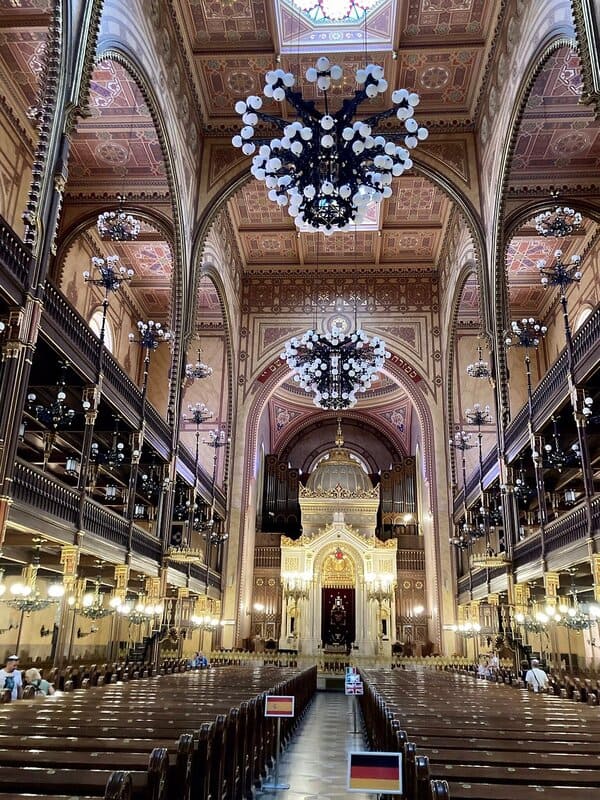
Locate an element on the screen. The height and width of the screenshot is (800, 600). ceiling is located at coordinates (426, 74).